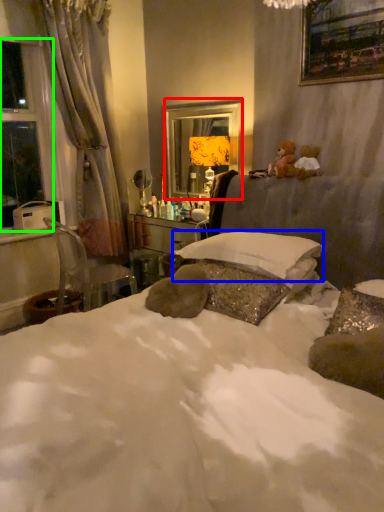
Question: Estimate the real-world distances between objects in this image. Which object is closer to mirror (highlighted by a red box), pillow (highlighted by a blue box) or window (highlighted by a green box)?

Choices:
 (A) pillow
 (B) window

Answer: (A)